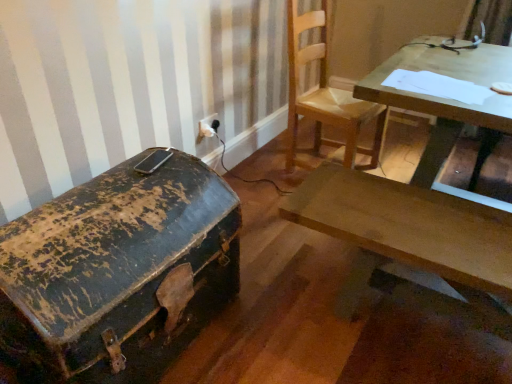
Question: Relative to white plastic electric outlet at upper center, is rusty metal trunk at left in front or behind?

Choices:
 (A) behind
 (B) front

Answer: (B)

Question: Looking at the image, does rusty metal trunk at left seem bigger or smaller compared to white plastic electric outlet at upper center?

Choices:
 (A) small
 (B) big

Answer: (B)

Question: Which of these objects is positioned closest to the white plastic electric outlet at upper center?

Choices:
 (A) wooden desk at center
 (B) wooden chair at upper center
 (C) rusty metal trunk at left
 (D) wooden table at upper right

Answer: (B)

Question: Which object is positioned farthest from the wooden chair at upper center?

Choices:
 (A) wooden table at upper right
 (B) rusty metal trunk at left
 (C) wooden desk at center
 (D) white plastic electric outlet at upper center

Answer: (B)